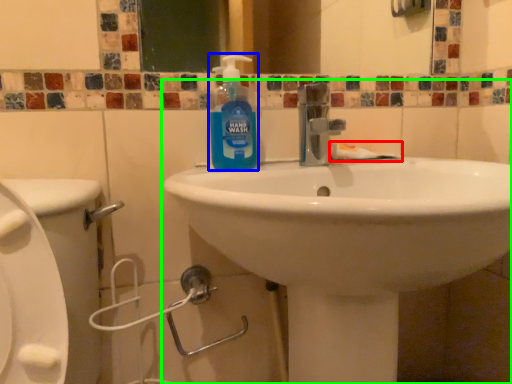
Question: Which is farther away from toothpaste (highlighted by a red box)? cleaning product (highlighted by a blue box) or sink (highlighted by a green box)?

Choices:
 (A) cleaning product
 (B) sink

Answer: (B)